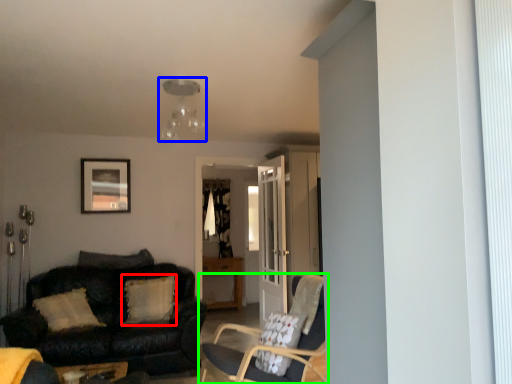
Question: Based on their relative distances, which object is farther from pillow (highlighted by a red box)? Choose from light fixture (highlighted by a blue box) and chair (highlighted by a green box).

Choices:
 (A) light fixture
 (B) chair

Answer: (A)